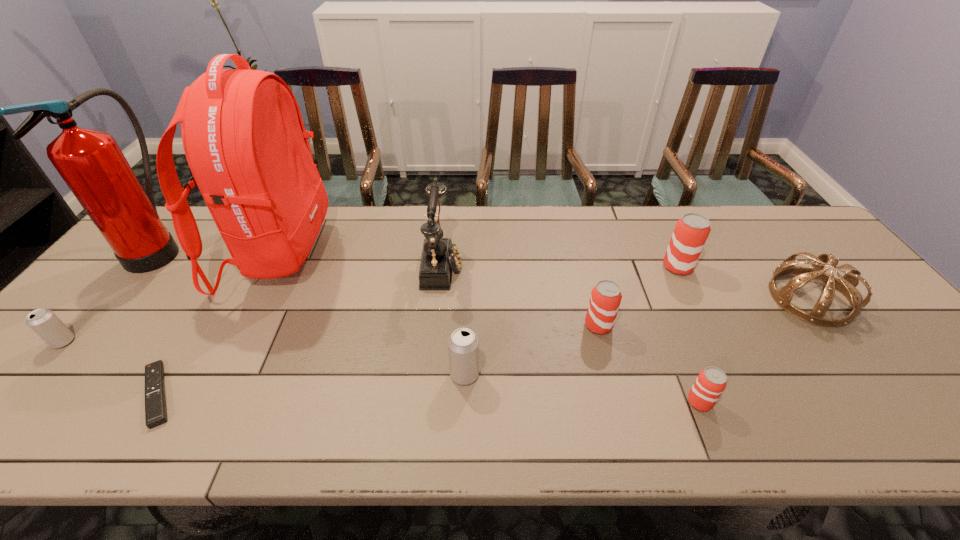
Find the location of a particular element. Image resolution: width=960 pixels, height=540 pixels. object that is the seventh closest to the rightmost orange beer can is located at coordinates (x=155, y=403).

The image size is (960, 540). In order to click on beer can identified as the closest to the second orange beer can from right to left in this screenshot , I will do `click(605, 299)`.

Locate an element on the screen. The width and height of the screenshot is (960, 540). beer can identified as the fourth closest to the fourth beer can from left to right is located at coordinates (44, 322).

Image resolution: width=960 pixels, height=540 pixels. What are the coordinates of `orange beer can that is the third closest to the red backpack` in the screenshot? It's located at (691, 231).

Locate which orange beer can is the second closest to the brown tiara. Please provide its 2D coordinates. Your answer should be formatted as a tuple, i.e. [(x, y)], where the tuple contains the x and y coordinates of a point satisfying the conditions above.

[(711, 382)]

Locate an element on the screen. The height and width of the screenshot is (540, 960). vacant space that satisfies the following two spatial constraints: 1. on the main compartment of the backpack; 2. on the right side of the second beer can from right to left is located at coordinates (201, 402).

The height and width of the screenshot is (540, 960). Identify the location of vacant space that satisfies the following two spatial constraints: 1. on the main compartment of the second orange beer can from left to right; 2. on the right side of the red backpack. (201, 402).

The image size is (960, 540). Identify the location of vacant space that satisfies the following two spatial constraints: 1. on the back side of the third object from right to left; 2. on the right side of the ninth object from left to right. (644, 267).

The height and width of the screenshot is (540, 960). Identify the location of free region that satisfies the following two spatial constraints: 1. on the front side of the brown tiara; 2. on the right side of the rightmost beer can. point(693,299).

This screenshot has height=540, width=960. What are the coordinates of `free space that satisfies the following two spatial constraints: 1. on the dial of the black telephone; 2. on the left side of the farthest beer can` in the screenshot? It's located at (442, 267).